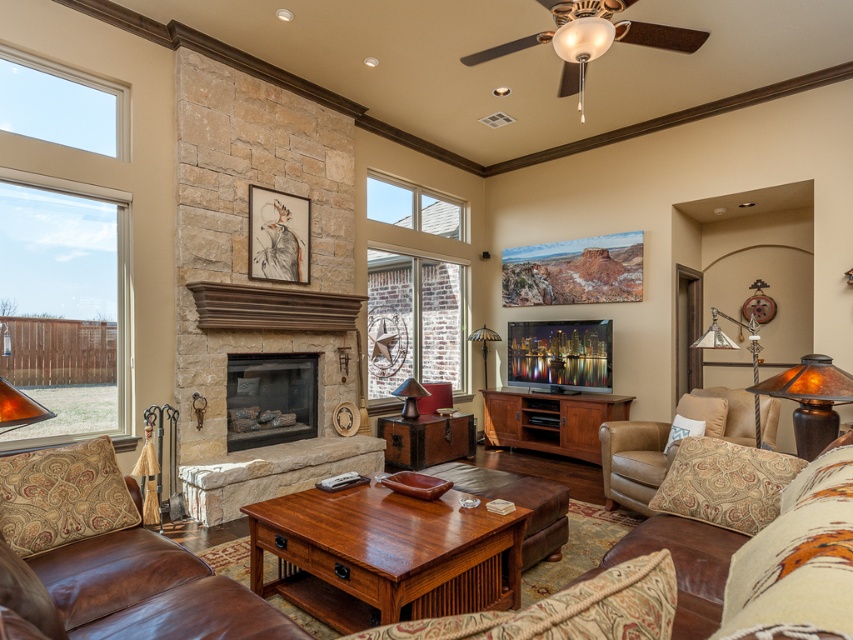
Question: Which object is closer to the camera taking this photo?

Choices:
 (A) amber glass lampshade at right
 (B) brown leather couch at center
 (C) brown leather armchair at lower right
 (D) clear glass window at center

Answer: (B)

Question: Is leather couch at right below amber glass lampshade at right?

Choices:
 (A) no
 (B) yes

Answer: (B)

Question: Can you confirm if clear glass window at left is smaller than leather couch at right?

Choices:
 (A) no
 (B) yes

Answer: (A)

Question: Is brown leather couch at lower left bigger than amber glass lampshade at right?

Choices:
 (A) yes
 (B) no

Answer: (A)

Question: Among these objects, which one is farthest from the camera?

Choices:
 (A) brown leather couch at lower left
 (B) brown wood tv stand at center
 (C) clear glass window at left
 (D) leather couch at right

Answer: (B)

Question: Which is nearer to the metallic silver floor lamp at right?

Choices:
 (A) brown leather armchair at lower right
 (B) clear glass window at left
 (C) leather couch at right
 (D) clear glass window at center

Answer: (A)